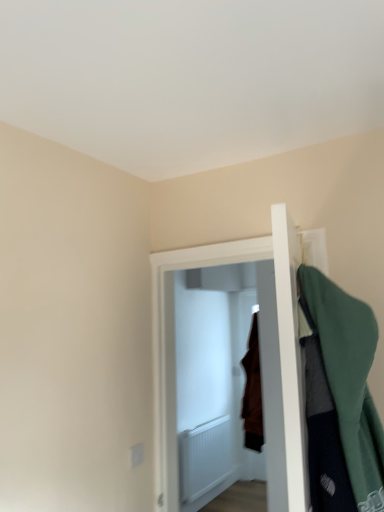
Question: Is white wooden door at center situated inside green fabric coat at right or outside?

Choices:
 (A) inside
 (B) outside

Answer: (B)

Question: In terms of width, does white wooden door at center look wider or thinner when compared to green fabric coat at right?

Choices:
 (A) wide
 (B) thin

Answer: (A)

Question: In terms of height, does white wooden door at center look taller or shorter compared to green fabric coat at right?

Choices:
 (A) short
 (B) tall

Answer: (B)

Question: In terms of width, does green fabric coat at right look wider or thinner when compared to white wooden door at center?

Choices:
 (A) wide
 (B) thin

Answer: (B)

Question: Based on their sizes in the image, would you say green fabric coat at right is bigger or smaller than white wooden door at center?

Choices:
 (A) small
 (B) big

Answer: (A)

Question: Considering the positions of point (354, 457) and point (157, 365), is point (354, 457) closer or farther from the camera than point (157, 365)?

Choices:
 (A) farther
 (B) closer

Answer: (B)

Question: Is green fabric coat at right inside or outside of white wooden door at center?

Choices:
 (A) outside
 (B) inside

Answer: (A)